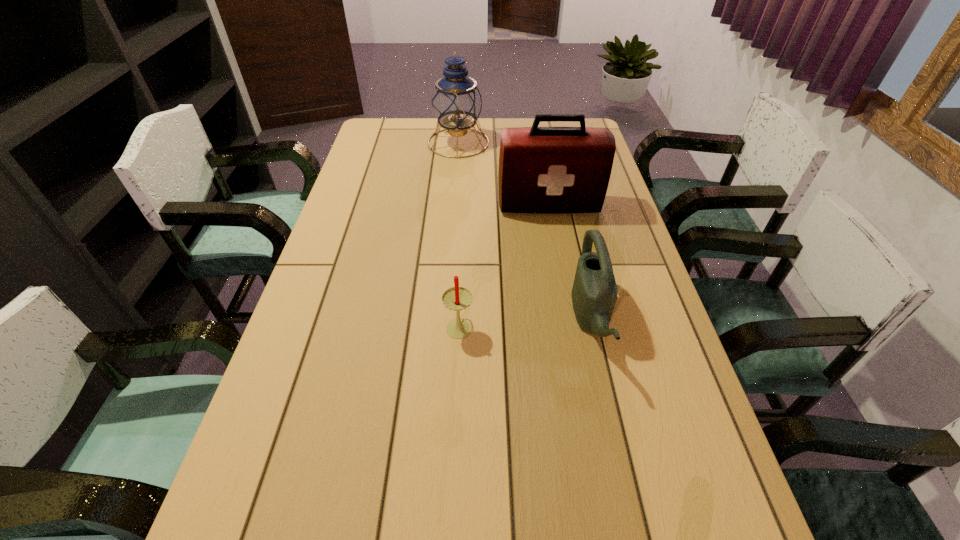
Identify the location of object that is at the far edge. (456, 102).

Find the location of a particular element. The image size is (960, 540). the first aid kit at the right edge is located at coordinates (542, 170).

Where is `watering can present at the right edge`? watering can present at the right edge is located at coordinates (594, 293).

The height and width of the screenshot is (540, 960). Identify the location of vacant area at the left edge of the desktop. (385, 180).

You are a GUI agent. You are given a task and a screenshot of the screen. Output one action in this format:
    pyautogui.click(x=<x>, y=<y>)
    Task: Click on the vacant space at the right edge of the desktop
    This screenshot has width=960, height=540.
    Given the screenshot: What is the action you would take?
    pyautogui.click(x=682, y=481)

Image resolution: width=960 pixels, height=540 pixels. Identify the location of vacant space at the far left corner of the desktop. (380, 133).

Locate an element on the screen. vacant area that lies between the watering can and the third nearest object is located at coordinates (570, 263).

You are a GUI agent. You are given a task and a screenshot of the screen. Output one action in this format:
    pyautogui.click(x=<x>, y=<y>)
    Task: Click on the free space between the candle and the farthest object
    This screenshot has height=540, width=960.
    Given the screenshot: What is the action you would take?
    pyautogui.click(x=459, y=234)

Find the location of a particular element. This screenshot has width=960, height=540. free space between the watering can and the lantern is located at coordinates (525, 231).

Where is `vacant space that's between the watering can and the lantern`? vacant space that's between the watering can and the lantern is located at coordinates (525, 231).